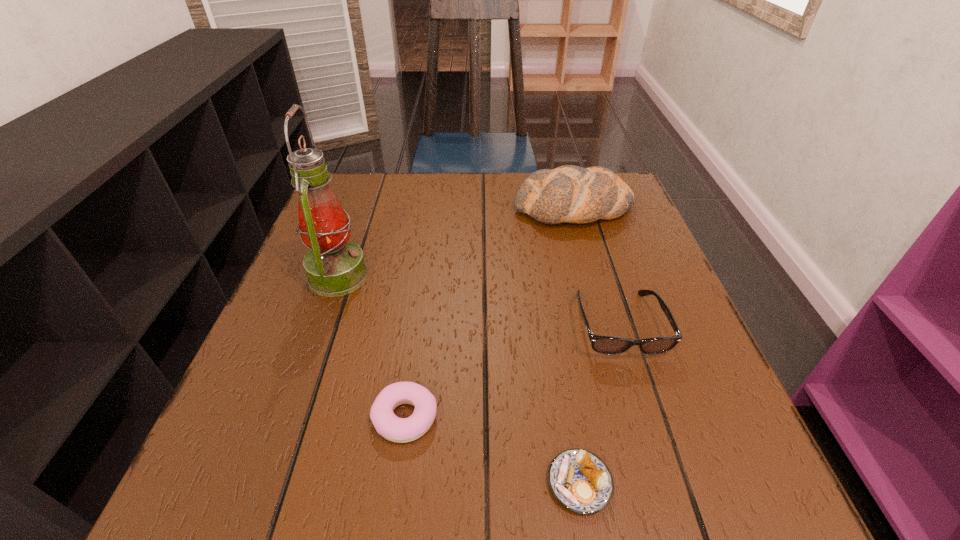
At what (x,y) coordinates should I click in order to perform the action: click on vacant space located on the front of the farthest object. Please return your answer as a coordinate pair (x, y). The height and width of the screenshot is (540, 960). Looking at the image, I should click on (602, 310).

Find the location of a particular element. The height and width of the screenshot is (540, 960). free spot located on the lenses of the third tallest object is located at coordinates (638, 387).

Where is `free space located on the left of the fourth tallest object`? The width and height of the screenshot is (960, 540). free space located on the left of the fourth tallest object is located at coordinates (264, 417).

Image resolution: width=960 pixels, height=540 pixels. What are the coordinates of `vacant space situated on the right of the right pastry` in the screenshot? It's located at (684, 483).

Locate an element on the screen. The width and height of the screenshot is (960, 540). object that is at the far edge is located at coordinates (572, 194).

Identify the location of object that is at the near edge. (579, 480).

Image resolution: width=960 pixels, height=540 pixels. Find the location of `object positioned at the left edge`. object positioned at the left edge is located at coordinates (335, 266).

Identify the location of bread that is at the right edge. (572, 194).

Locate an element on the screen. The width and height of the screenshot is (960, 540). spectacles present at the right edge is located at coordinates (609, 345).

Locate an element on the screen. The height and width of the screenshot is (540, 960). object positioned at the far right corner is located at coordinates (572, 194).